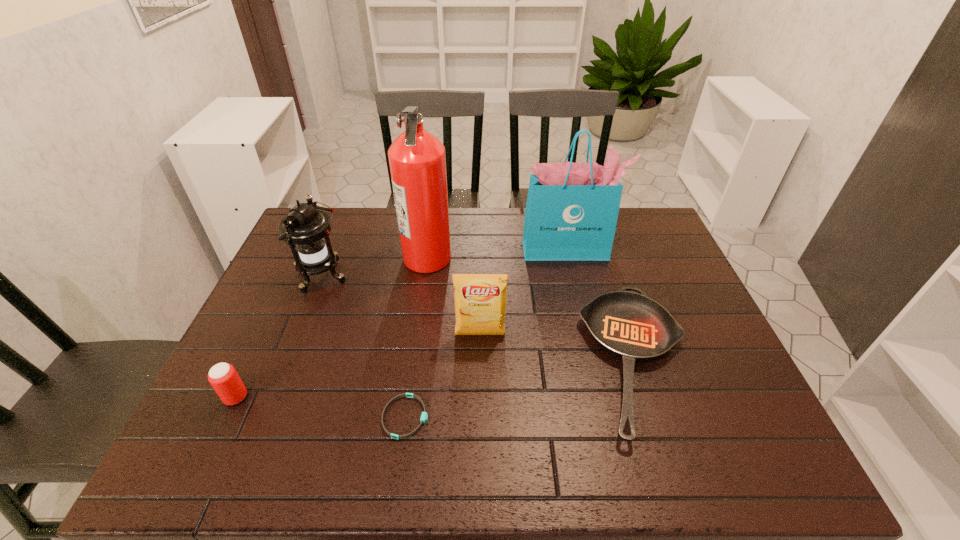
You are a GUI agent. You are given a task and a screenshot of the screen. Output one action in this format:
    pyautogui.click(x=<x>, y=<y>)
    Task: Click on the free space that satisfies the following two spatial constraints: 1. at the nozzle of the tallest object; 2. on the right side of the sixth tallest object
    Image resolution: width=960 pixels, height=540 pixels.
    Given the screenshot: What is the action you would take?
    pyautogui.click(x=413, y=360)

Locate an element on the screen. The image size is (960, 540). vacant space that satisfies the following two spatial constraints: 1. on the front side of the shopping bag; 2. at the nozzle of the fire extinguisher is located at coordinates (569, 257).

What are the coordinates of `free space in the image that satisfies the following two spatial constraints: 1. on the front of the fifth object from left to right with the logo; 2. on the buckle of the shortest object` in the screenshot? It's located at (480, 417).